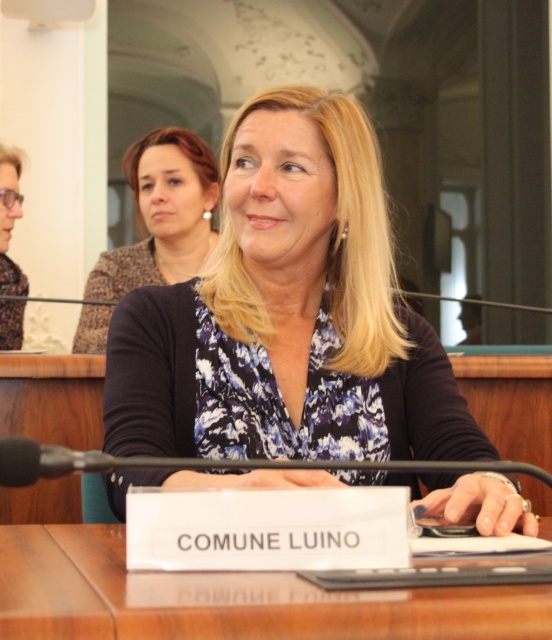
Is matte black blazer at upper center taller than matte black glasses at left?

Correct, matte black blazer at upper center is much taller as matte black glasses at left.

Can you confirm if matte black blazer at upper center is wider than matte black glasses at left?

Yes, matte black blazer at upper center is wider than matte black glasses at left.

Who is more distant from viewer, (209, 244) or (3, 280)?

The point (209, 244) is more distant.

At what (x,y) coordinates should I click in order to perform the action: click on matte black blazer at upper center. Please return your answer as a coordinate pair (x, y). Looking at the image, I should click on click(x=162, y=214).

Is blue floral blouse at center smaller than matte black glasses at left?

Actually, blue floral blouse at center might be larger than matte black glasses at left.

In the scene shown: Is blue floral blouse at center below matte black glasses at left?

Correct, blue floral blouse at center is located below matte black glasses at left.

Where is `blue floral blouse at center`? This screenshot has width=552, height=640. blue floral blouse at center is located at coordinates (289, 314).

Between blue floral blouse at center and wooden table at center, which one is positioned higher?

blue floral blouse at center is above.

Can you confirm if blue floral blouse at center is shorter than wooden table at center?

In fact, blue floral blouse at center may be taller than wooden table at center.

I want to click on blue floral blouse at center, so click(x=289, y=314).

You are a GUI agent. You are given a task and a screenshot of the screen. Output one action in this format:
    pyautogui.click(x=<x>, y=<y>)
    Task: Click on the blue floral blouse at center
    Image resolution: width=552 pixels, height=640 pixels.
    Given the screenshot: What is the action you would take?
    pyautogui.click(x=289, y=314)